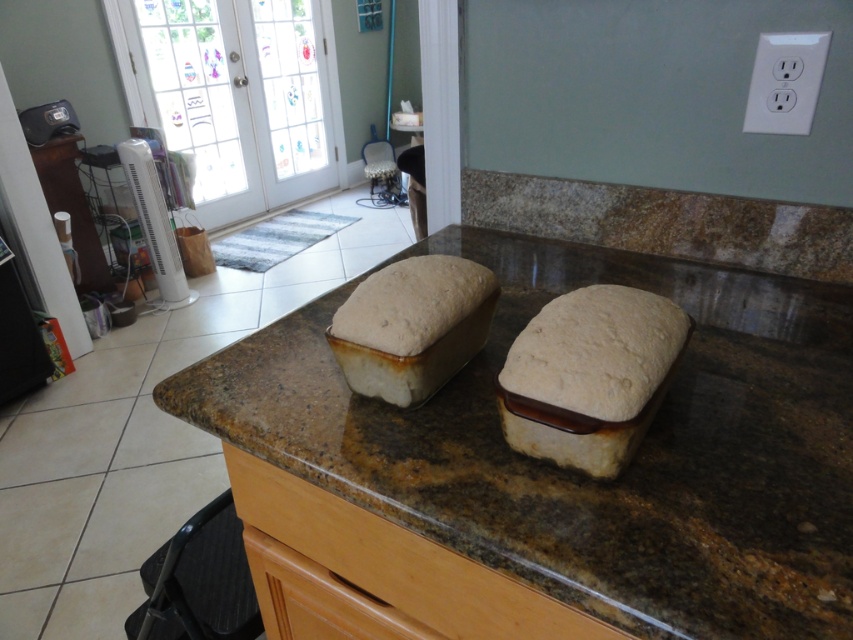
Which is above, brown granite countertop at center or spongy white bread at center?

spongy white bread at center

Is brown granite countertop at center to the left of spongy white bread at center from the viewer's perspective?

Yes, brown granite countertop at center is to the left of spongy white bread at center.

Is point (410, 516) positioned in front of point (578, 346)?

Yes, it is in front of point (578, 346).

Where is `brown granite countertop at center`? brown granite countertop at center is located at coordinates (561, 468).

Between point (689, 488) and point (393, 337), which one is positioned in front?

Point (689, 488) is more forward.

Measure the distance from brown granite countertop at center to matte ceramic loaf at center.

brown granite countertop at center and matte ceramic loaf at center are 7.49 inches apart from each other.

Between point (213, 424) and point (469, 337), which one is positioned in front?

Point (213, 424)

You are a GUI agent. You are given a task and a screenshot of the screen. Output one action in this format:
    pyautogui.click(x=<x>, y=<y>)
    Task: Click on the brown granite countertop at center
    
    Given the screenshot: What is the action you would take?
    pyautogui.click(x=561, y=468)

Can you confirm if brown granite countertop at center is positioned to the left of wooden drawer at center?

No, brown granite countertop at center is not to the left of wooden drawer at center.

At what (x,y) coordinates should I click in order to perform the action: click on brown granite countertop at center. Please return your answer as a coordinate pair (x, y). The image size is (853, 640). Looking at the image, I should click on (561, 468).